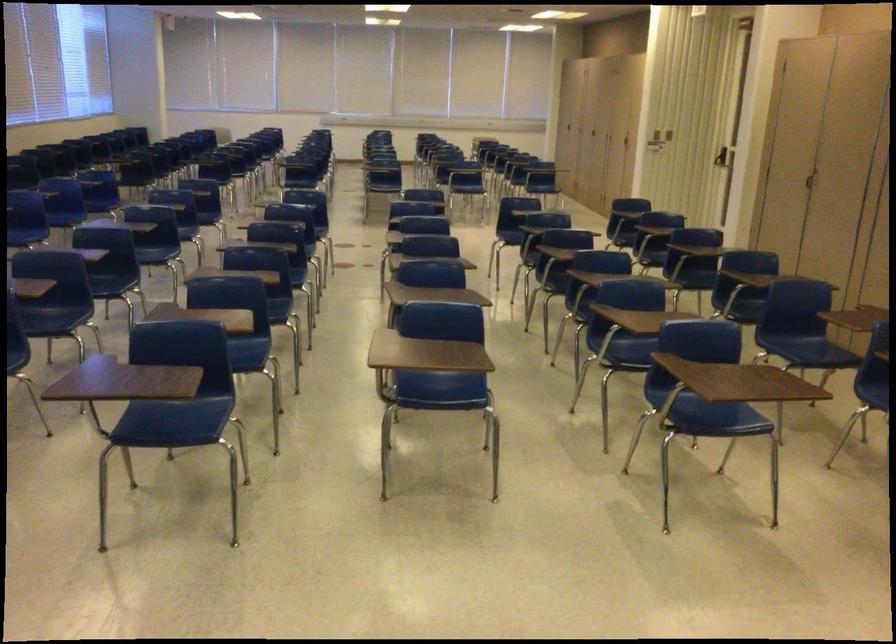
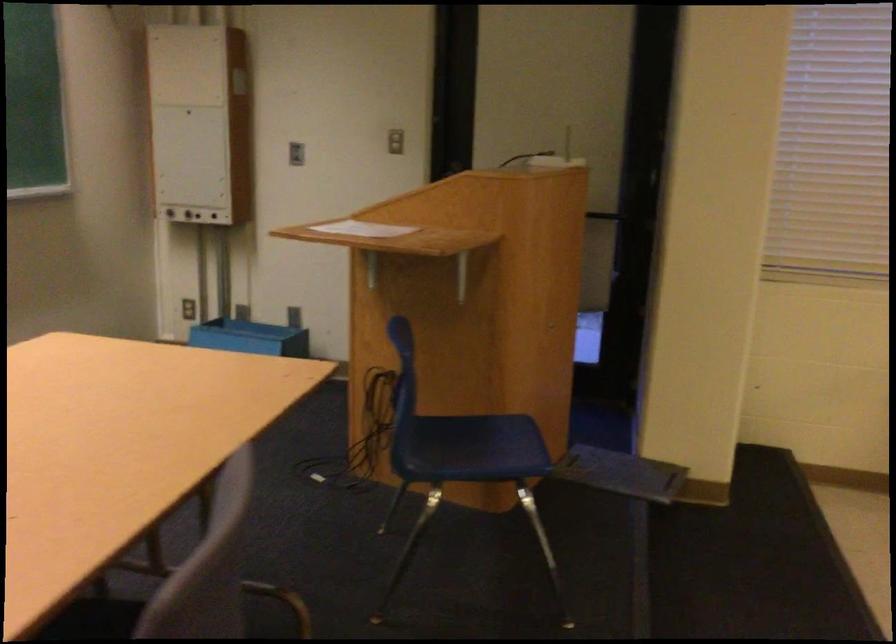
Consider the image. The first image is from the beginning of the video and the second image is from the end. How did the camera likely rotate when shooting the video?

The camera rotated toward left-down.